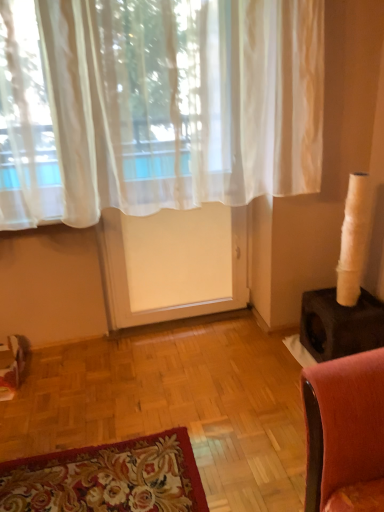
Question: From the image's perspective, is white sheer screen door at center located above or below sheer white curtain at upper center?

Choices:
 (A) above
 (B) below

Answer: (B)

Question: Is white sheer screen door at center in front of or behind sheer white curtain at upper center in the image?

Choices:
 (A) front
 (B) behind

Answer: (B)

Question: Is white sheer screen door at center to the left or to the right of sheer white curtain at upper center in the image?

Choices:
 (A) right
 (B) left

Answer: (B)

Question: Is sheer white curtain at upper center taller or shorter than white sheer screen door at center?

Choices:
 (A) short
 (B) tall

Answer: (A)

Question: Would you say sheer white curtain at upper center is to the left or to the right of white sheer screen door at center in the picture?

Choices:
 (A) right
 (B) left

Answer: (A)

Question: Based on their sizes in the image, would you say sheer white curtain at upper center is bigger or smaller than white sheer screen door at center?

Choices:
 (A) small
 (B) big

Answer: (B)

Question: Is sheer white curtain at upper center inside or outside of white sheer screen door at center?

Choices:
 (A) outside
 (B) inside

Answer: (A)